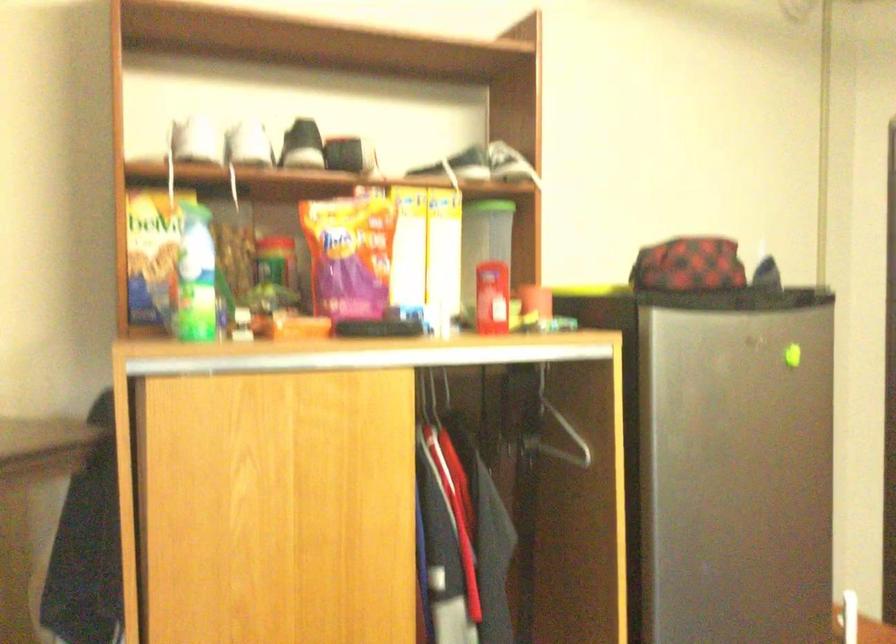
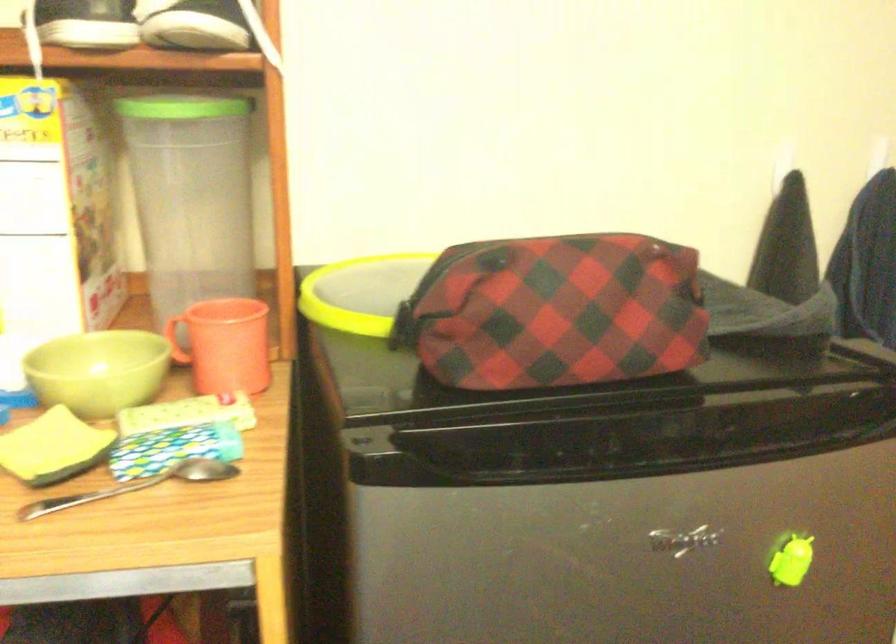
Where in the second image is the point corresponding to point 545,335 from the first image?

(135, 486)